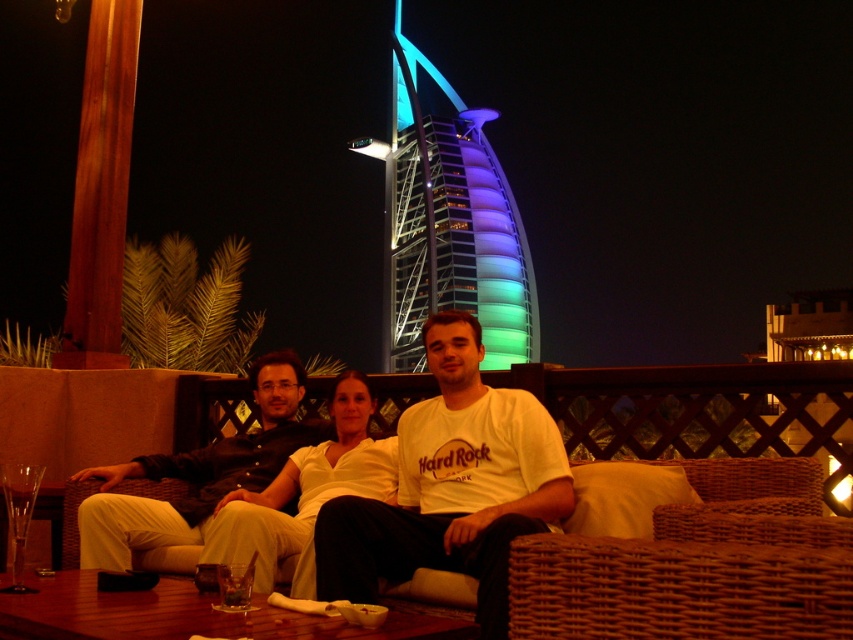
Who is lower down, white matte shirt at center or clear glass wine glass at lower left?

Positioned lower is white matte shirt at center.

Which is more to the right, white matte shirt at center or clear glass wine glass at lower left?

Positioned to the right is white matte shirt at center.

Is point (364, 387) behind point (6, 477)?

Yes.

Where is `white matte shirt at center`? Image resolution: width=853 pixels, height=640 pixels. white matte shirt at center is located at coordinates (305, 493).

What do you see at coordinates (196, 474) in the screenshot?
I see `light beige fabric couch at center` at bounding box center [196, 474].

Is light beige fabric couch at center behind white matte shirt at center?

Yes, light beige fabric couch at center is further from the viewer.

Which is in front, point (160, 525) or point (370, 468)?

Point (160, 525) is in front.

Locate an element on the screen. The image size is (853, 640). light beige fabric couch at center is located at coordinates click(x=196, y=474).

Is multicolored glass tower at center shorter than clear glass wine glass at lower left?

No, multicolored glass tower at center is not shorter than clear glass wine glass at lower left.

Is multicolored glass tower at center bigger than clear glass wine glass at lower left?

Correct, multicolored glass tower at center is larger in size than clear glass wine glass at lower left.

Is point (488, 268) closer to camera compared to point (33, 476)?

No, (488, 268) is behind (33, 476).

At what (x,y) coordinates should I click in order to perform the action: click on multicolored glass tower at center. Please return your answer as a coordinate pair (x, y). Looking at the image, I should click on (450, 224).